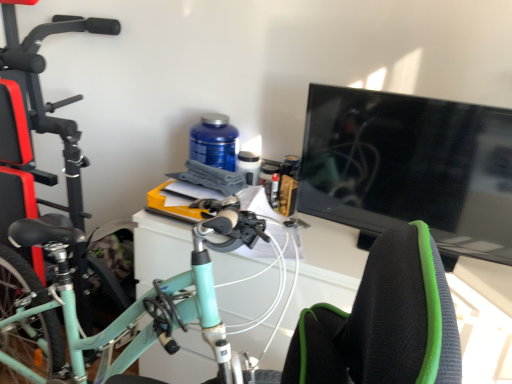
Question: From a real-world perspective, is black glossy tv at right beneath white glossy computer desk at center?

Choices:
 (A) yes
 (B) no

Answer: (B)

Question: Is the position of black glossy tv at right more distant than that of white glossy computer desk at center?

Choices:
 (A) yes
 (B) no

Answer: (A)

Question: Is white glossy computer desk at center inside black glossy tv at right?

Choices:
 (A) yes
 (B) no

Answer: (B)

Question: Could you tell me if black glossy tv at right is turned towards white glossy computer desk at center?

Choices:
 (A) yes
 (B) no

Answer: (A)

Question: Does black glossy tv at right appear on the left side of white glossy computer desk at center?

Choices:
 (A) yes
 (B) no

Answer: (B)

Question: Is point (233, 150) positioned closer to the camera than point (501, 296)?

Choices:
 (A) closer
 (B) farther

Answer: (B)

Question: Is blue plastic bottle at center taller or shorter than white glossy computer desk at center?

Choices:
 (A) tall
 (B) short

Answer: (B)

Question: Considering the relative positions of blue plastic bottle at center and white glossy computer desk at center in the image provided, is blue plastic bottle at center to the left or to the right of white glossy computer desk at center?

Choices:
 (A) left
 (B) right

Answer: (A)

Question: In terms of size, does blue plastic bottle at center appear bigger or smaller than white glossy computer desk at center?

Choices:
 (A) big
 (B) small

Answer: (B)

Question: From their relative heights in the image, would you say mint green matte bicycle at left is taller or shorter than white glossy computer desk at center?

Choices:
 (A) tall
 (B) short

Answer: (A)

Question: From the image's perspective, relative to white glossy computer desk at center, is mint green matte bicycle at left above or below?

Choices:
 (A) above
 (B) below

Answer: (A)

Question: From a real-world perspective, is mint green matte bicycle at left above or below white glossy computer desk at center?

Choices:
 (A) above
 (B) below

Answer: (B)

Question: Is point (79, 180) positioned closer to the camera than point (326, 296)?

Choices:
 (A) closer
 (B) farther

Answer: (B)

Question: Considering their positions, is white glossy computer desk at center located in front of or behind black glossy tv at right?

Choices:
 (A) behind
 (B) front

Answer: (B)

Question: Is white glossy computer desk at center bigger or smaller than black glossy tv at right?

Choices:
 (A) small
 (B) big

Answer: (B)